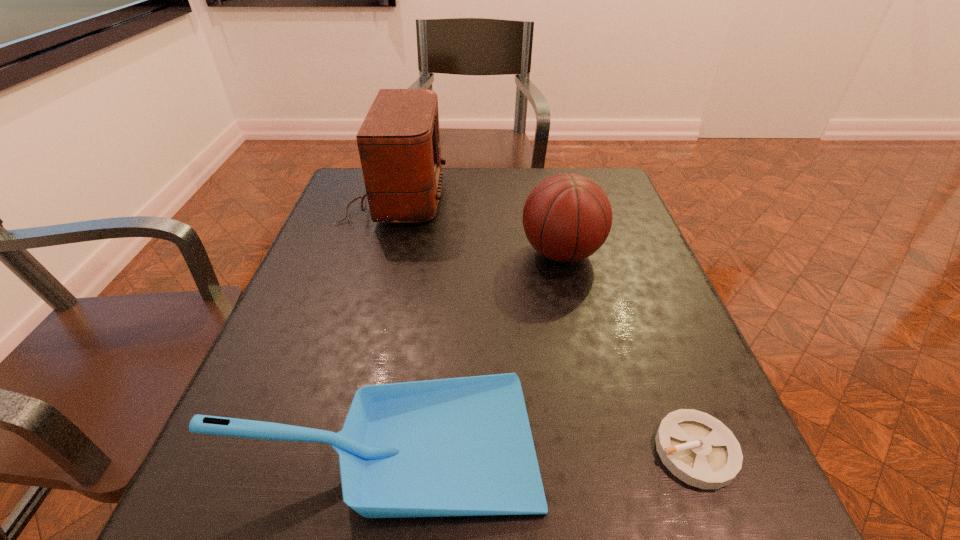
The image size is (960, 540). In the image, there is a desktop. Identify the location of free region at the far edge. (528, 194).

Identify the location of free space at the left edge. The image size is (960, 540). (303, 416).

Locate an element on the screen. This screenshot has height=540, width=960. vacant region at the right edge of the desktop is located at coordinates (607, 271).

This screenshot has height=540, width=960. I want to click on free spot between the dustpan and the basketball, so click(475, 347).

What are the coordinates of `vacant region between the third tallest object and the farthest object` in the screenshot? It's located at (393, 319).

Where is `empty space that is in between the second farthest object and the tallest object`? empty space that is in between the second farthest object and the tallest object is located at coordinates coord(479,225).

Find the location of `vacant area that lies between the third nearest object and the tallest object`. vacant area that lies between the third nearest object and the tallest object is located at coordinates (479, 225).

Locate an element on the screen. Image resolution: width=960 pixels, height=540 pixels. free spot between the second shortest object and the ashtray is located at coordinates (542, 446).

This screenshot has height=540, width=960. In order to click on free space between the radio receiver and the ashtray in this screenshot , I will do `click(545, 323)`.

Find the location of a particular element. The width and height of the screenshot is (960, 540). vacant space that is in between the tallest object and the basketball is located at coordinates (479, 225).